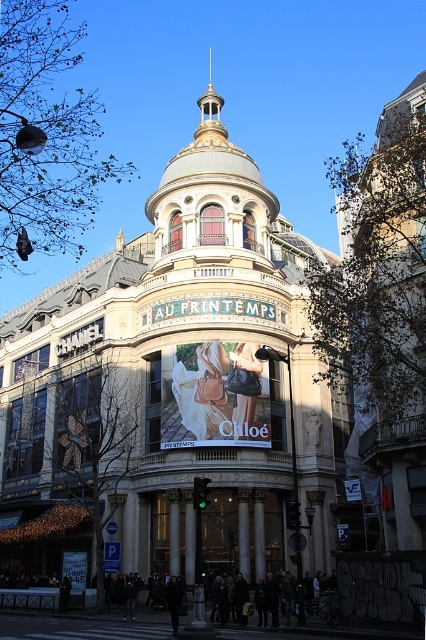
You are an architect examining the building facade. You notice the gold metallic dome at center and the leather handbag at center. Which object appears larger in the image?

The gold metallic dome at center is bigger than the leather handbag at center, so the gold metallic dome at center appears larger in the image.

You are standing in front of the grand building and want to locate the point at coordinates (175, 385). Based on the scene description, where exactly is this point located?

The point at coordinates (175, 385) is located on the gold metallic dome at center.